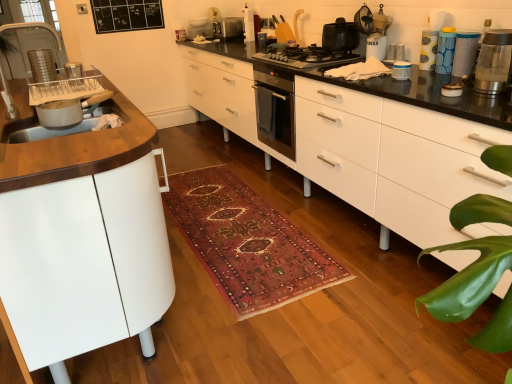
Question: In the image, is blue textured canister at upper right, which is counted as the fifth appliance, starting from the left, on the left side or the right side of black matte gas stove at center?

Choices:
 (A) right
 (B) left

Answer: (A)

Question: Is blue textured canister at upper right, the third appliance ordered from the bottom, in front of or behind black matte gas stove at center in the image?

Choices:
 (A) front
 (B) behind

Answer: (A)

Question: Which object is positioned closest to the white glossy chest of drawers at center?

Choices:
 (A) matte plastic container at upper right, which appears as the sixth appliance when viewed from the left
 (B) white glossy toaster at upper center, the 6th appliance positioned from the bottom
 (C) black matte gas stove at center
 (D) white matte cabinet at left
 (E) white glossy container at upper right, which is the fifth appliance from right to left

Answer: (C)

Question: Which of these objects is positioned farthest from the white matte cabinet at left?

Choices:
 (A) black matte gas stove at center
 (B) satin silver toaster at upper center, the 1th kitchen appliance from the back
 (C) matte white sink at left
 (D) clear glass water filter at upper right, the 1th kitchen appliance viewed from the right
 (E) white glossy container at upper right, which is the first appliance in bottom-to-top order

Answer: (B)